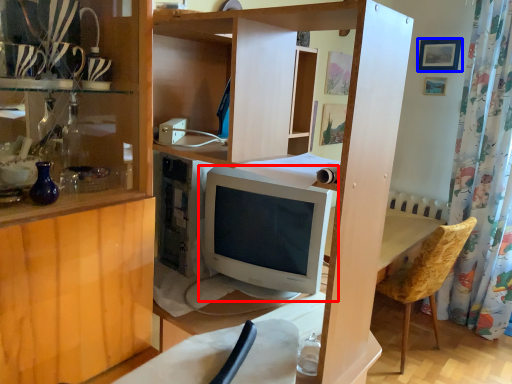
Question: Which point is further to the camera, computer monitor (highlighted by a red box) or picture frame (highlighted by a blue box)?

Choices:
 (A) computer monitor
 (B) picture frame

Answer: (B)